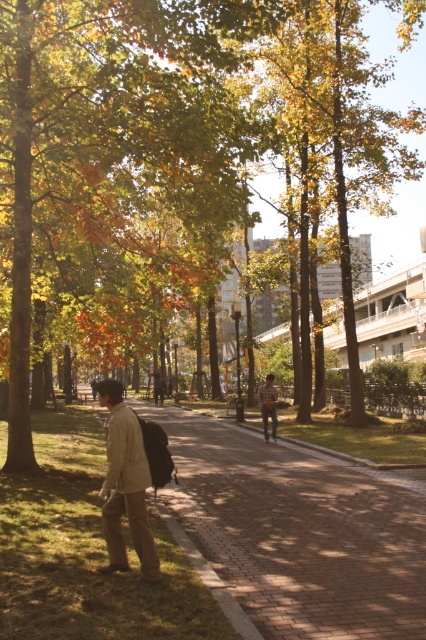
Question: Which object appears closest to the camera in this image?

Choices:
 (A) green leafy tree at center
 (B) plaid shirt at center

Answer: (A)

Question: Based on their relative distances, which object is farther from the green leafy tree at center?

Choices:
 (A) plaid shirt at center
 (B) khaki cotton jacket at left

Answer: (B)

Question: Which object is closer to the camera taking this photo?

Choices:
 (A) khaki cotton jacket at left
 (B) brick paved path at center
 (C) green leafy tree at center
 (D) plaid shirt at center

Answer: (B)

Question: Does khaki cotton jacket at left appear on the right side of plaid shirt at center?

Choices:
 (A) no
 (B) yes

Answer: (A)

Question: In this image, where is green leafy tree at center located relative to khaki cotton jacket at left?

Choices:
 (A) left
 (B) right

Answer: (B)

Question: Can you confirm if brick paved path at center is bigger than khaki cotton jacket at left?

Choices:
 (A) no
 (B) yes

Answer: (B)